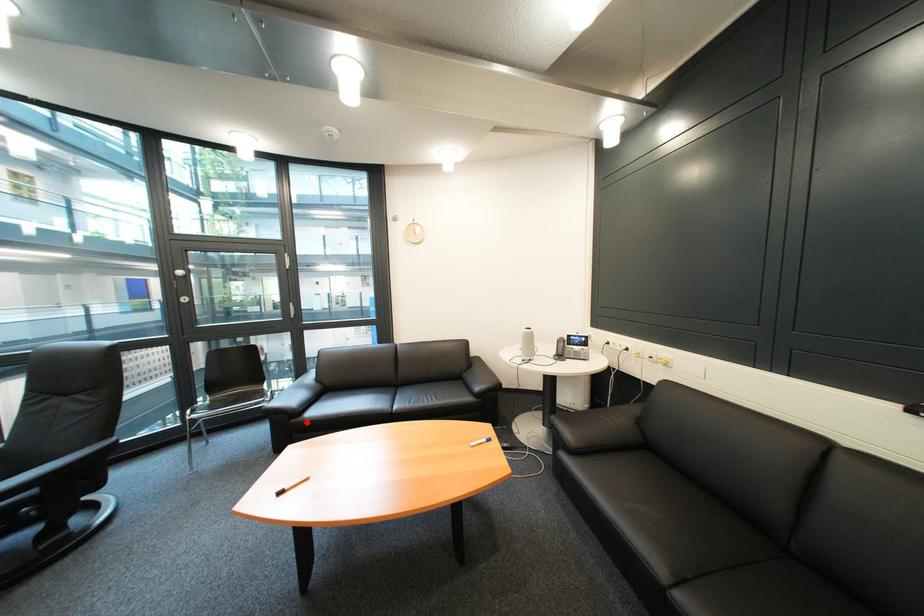
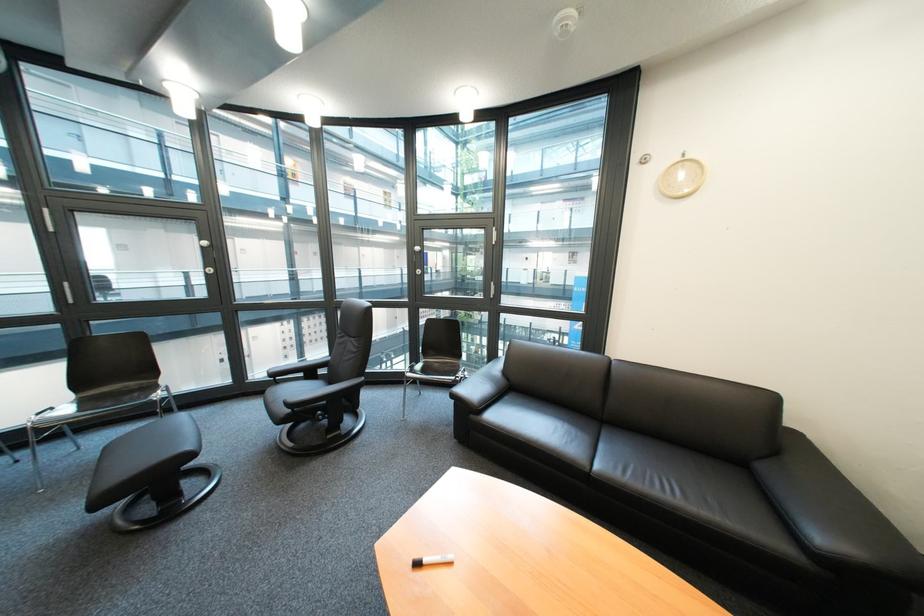
In the second image, find the point that corresponds to the highlighted location in the first image.

(485, 418)